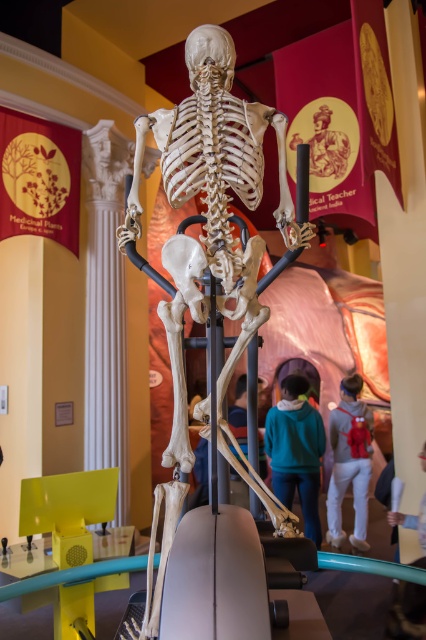
Question: Does teal hoodie at center have a smaller size compared to gray hoodie at center?

Choices:
 (A) yes
 (B) no

Answer: (B)

Question: Which of these objects is positioned farthest from the gray hoodie at center?

Choices:
 (A) white bone skeleton at center
 (B) teal hoodie at center

Answer: (A)

Question: Which point appears farthest from the camera in this image?

Choices:
 (A) (215, 141)
 (B) (348, 429)
 (C) (310, 426)

Answer: (B)

Question: Is white bone skeleton at center to the right of teal hoodie at center from the viewer's perspective?

Choices:
 (A) yes
 (B) no

Answer: (B)

Question: Estimate the real-world distances between objects in this image. Which object is farther from the teal hoodie at center?

Choices:
 (A) white bone skeleton at center
 (B) gray hoodie at center

Answer: (A)

Question: Is white bone skeleton at center above gray hoodie at center?

Choices:
 (A) no
 (B) yes

Answer: (B)